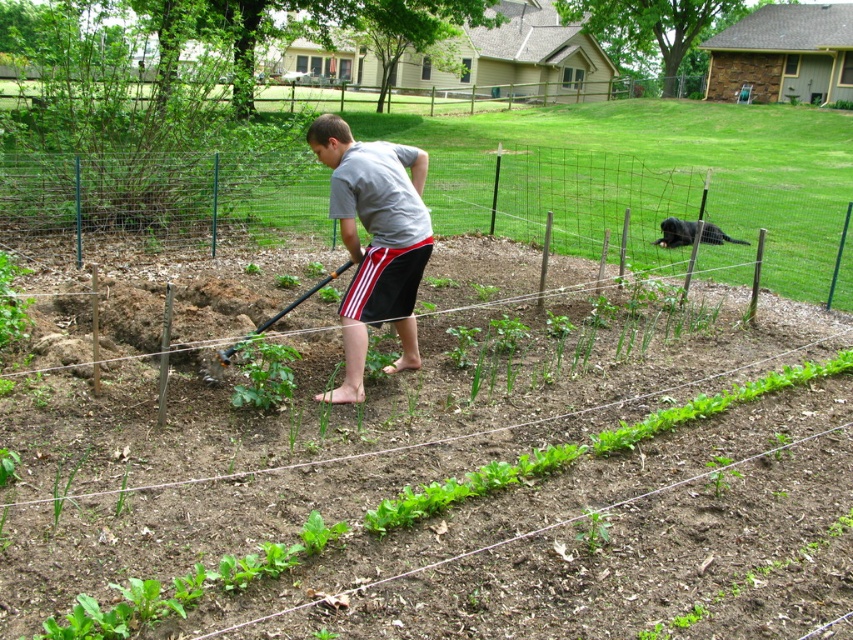
Question: Is brushed metal shovel at center above black fur dog at upper right?

Choices:
 (A) no
 (B) yes

Answer: (A)

Question: Estimate the real-world distances between objects in this image. Which object is closer to the matte gray shirt at center?

Choices:
 (A) brushed metal shovel at center
 (B) black fur dog at upper right

Answer: (A)

Question: Estimate the real-world distances between objects in this image. Which object is closer to the brushed metal shovel at center?

Choices:
 (A) matte gray shirt at center
 (B) black fur dog at upper right

Answer: (A)

Question: Can you confirm if matte gray shirt at center is positioned below black fur dog at upper right?

Choices:
 (A) no
 (B) yes

Answer: (B)

Question: Is brushed metal shovel at center wider than black fur dog at upper right?

Choices:
 (A) yes
 (B) no

Answer: (B)

Question: Which is nearer to the brushed metal shovel at center?

Choices:
 (A) matte gray shirt at center
 (B) black fur dog at upper right

Answer: (A)